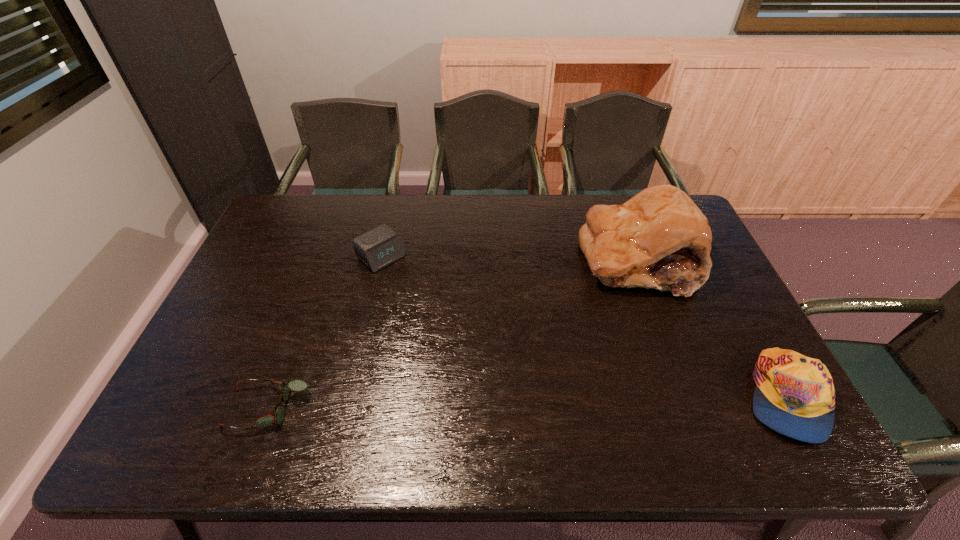
Where is `object that is at the far right corner`? The width and height of the screenshot is (960, 540). object that is at the far right corner is located at coordinates (659, 239).

Image resolution: width=960 pixels, height=540 pixels. What are the coordinates of `object present at the near right corner` in the screenshot? It's located at (794, 395).

Image resolution: width=960 pixels, height=540 pixels. I want to click on vacant space at the far edge, so click(554, 218).

Locate an element on the screen. The height and width of the screenshot is (540, 960). free space at the near edge of the desktop is located at coordinates (560, 401).

Where is `free space at the left edge of the desktop`? This screenshot has width=960, height=540. free space at the left edge of the desktop is located at coordinates (308, 239).

Find the location of a particular element. This screenshot has height=540, width=960. free region at the right edge of the desktop is located at coordinates (732, 371).

Identify the location of vacant space at the near left corner of the desktop. This screenshot has width=960, height=540. (180, 397).

In order to click on empty space that is in between the bread and the alarm clock in this screenshot , I will do `click(510, 259)`.

Find the location of `free spot between the second tallest object and the alarm clock`. free spot between the second tallest object and the alarm clock is located at coordinates (584, 327).

Identify the location of free area in between the bread and the leftmost object. Image resolution: width=960 pixels, height=540 pixels. (453, 334).